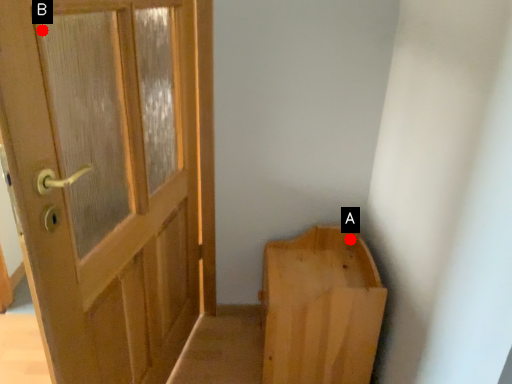
Question: Two points are circled on the image, labeled by A and B beside each circle. Among these points, which one is nearest to the camera?

Choices:
 (A) A is closer
 (B) B is closer

Answer: (A)